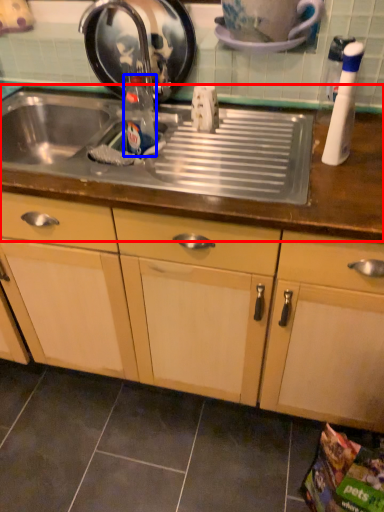
Question: Which object appears farthest to the camera in this image, countertop (highlighted by a red box) or bottle (highlighted by a blue box)?

Choices:
 (A) countertop
 (B) bottle

Answer: (B)